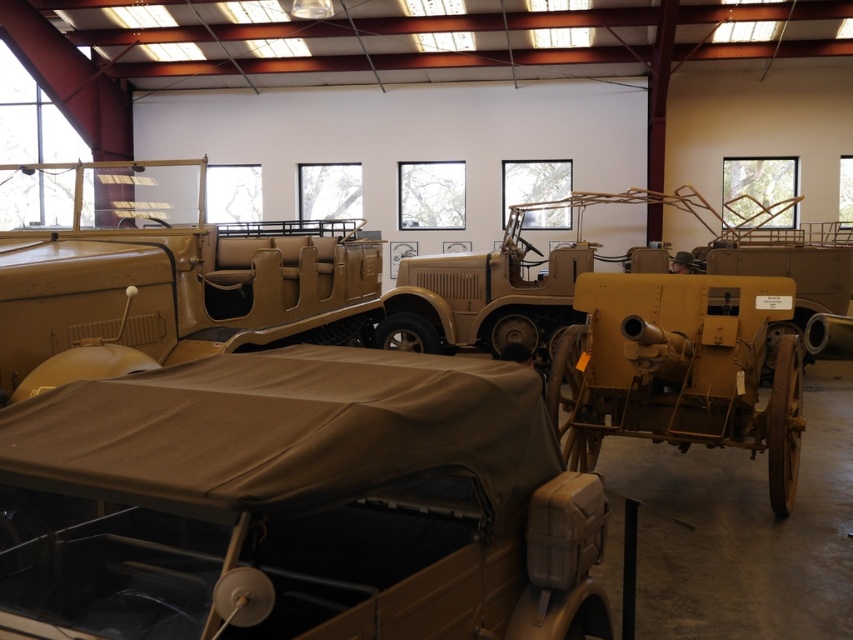
You are a tour guide leading a group through the museum and want to point out the matte khaki car at center and the matte tan jeep at center. Which one would you mention first if you want to follow the order from closest to farthest from the group?

The matte khaki car at center is closer to the viewer than the matte tan jeep at center, so you should mention the matte khaki car at center first.

You are a museum guide explaining the vehicles to a group. You need to clarify the size difference between the matte khaki car at center and the matte tan jeep at center. Which one is shorter?

The matte khaki car at center is shorter than the matte tan jeep at center.